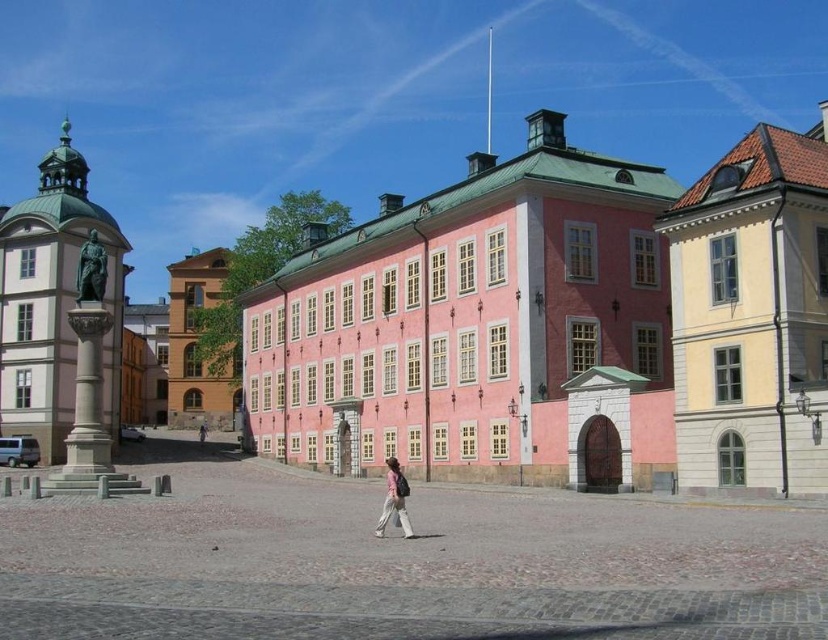
Question: Is green patina statue at left further to the viewer compared to light brown leather jacket at center?

Choices:
 (A) no
 (B) yes

Answer: (A)

Question: Which object is the farthest from the polished bronze statue at left?

Choices:
 (A) light brown leather jacket at center
 (B) pink matte building at center
 (C) green patina statue at left

Answer: (A)

Question: Which object appears closest to the camera in this image?

Choices:
 (A) pink matte building at center
 (B) light brown leather jacket at center
 (C) matte yellow building at center

Answer: (A)

Question: Can you confirm if polished bronze statue at left is positioned to the right of pink fabric pants at lower center?

Choices:
 (A) yes
 (B) no

Answer: (B)

Question: Which object is farther from the camera taking this photo?

Choices:
 (A) pink fabric pants at lower center
 (B) polished bronze statue at left
 (C) light brown leather jacket at center

Answer: (C)

Question: Does pink matte building at center appear over yellow matte building at upper right?

Choices:
 (A) no
 (B) yes

Answer: (A)